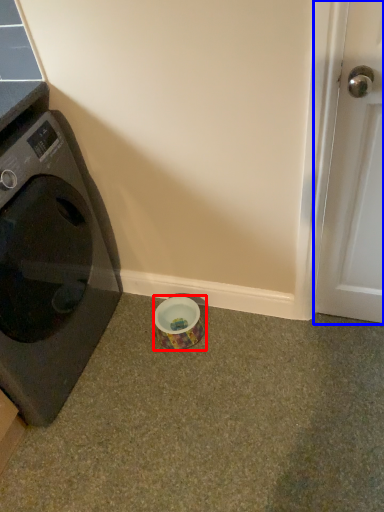
Question: Which of the following is the farthest to the observer, tape (highlighted by a red box) or door (highlighted by a blue box)?

Choices:
 (A) tape
 (B) door

Answer: (A)